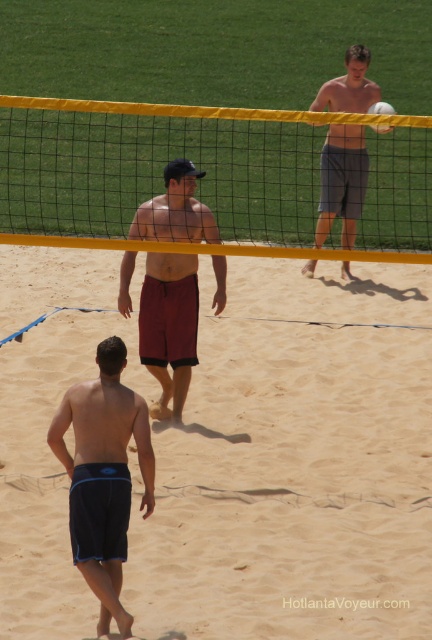
Question: From the image, what is the correct spatial relationship of sandy beach at center in relation to gray cotton shorts at upper right?

Choices:
 (A) above
 (B) below

Answer: (B)

Question: Which point is closer to the camera taking this photo?

Choices:
 (A) (365, 374)
 (B) (118, 499)
 (C) (387, 108)

Answer: (B)

Question: Which is nearer to the gray cotton shorts at upper right?

Choices:
 (A) sandy beach at center
 (B) dark blue shorts at center
 (C) white matte volleyball at upper center

Answer: (C)

Question: Where is sandy beach at center located in relation to yellow mesh net at center in the image?

Choices:
 (A) above
 (B) below

Answer: (B)

Question: Which object is farther from the camera taking this photo?

Choices:
 (A) dark blue shorts at center
 (B) gray cotton shorts at upper right

Answer: (B)

Question: Does dark blue shorts at center have a lesser width compared to matte red shorts at center?

Choices:
 (A) no
 (B) yes

Answer: (B)